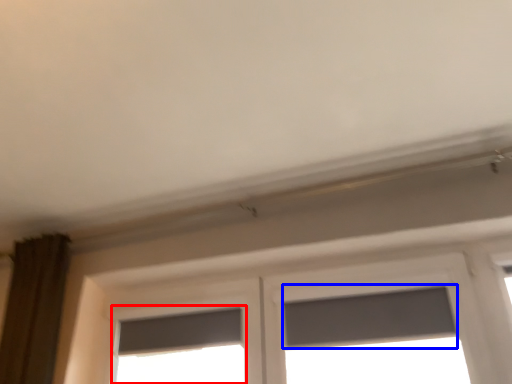
Question: Which object appears farthest to the camera in this image, window (highlighted by a red box) or window screen (highlighted by a blue box)?

Choices:
 (A) window
 (B) window screen

Answer: (A)